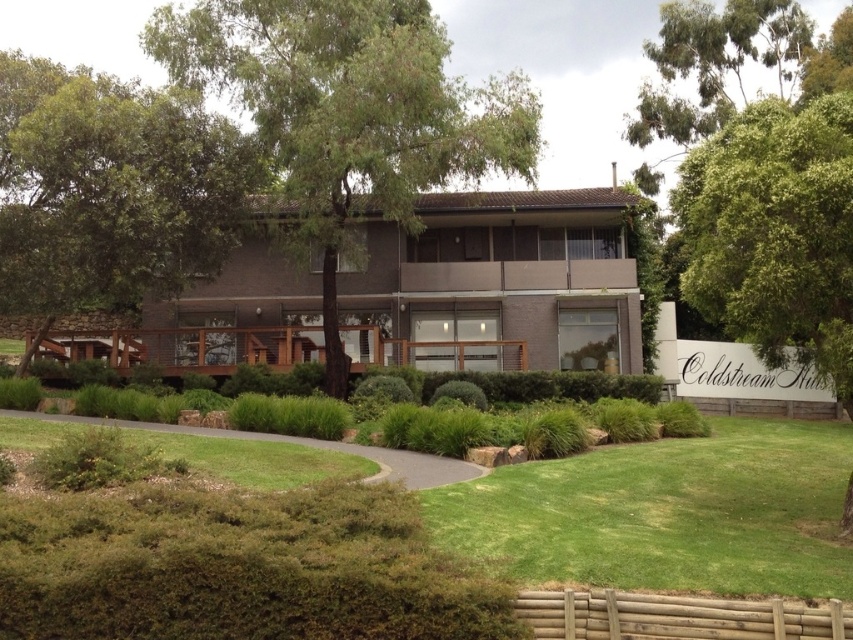
You are a landscape architect designing a walking path that must pass between the green leafy tree at center and the green grass at lower center. Given that the path must be at least 1 meter wide, can the existing space accommodate this requirement?

The green leafy tree at center is wider than the green grass at lower center. Since the tree is wider, the space between them may not be sufficient for a 1 meter wide path. However, without exact measurements, it is difficult to confirm. The description only states the tree is wider, but not by how much.

You are planning to place a picnic blanket on the green grass at lower center and the green grass at lower left. Which area would allow for more space for your blanket?

The green grass at lower center has a larger size compared to the green grass at lower left, so it would allow more space for your picnic blanket.